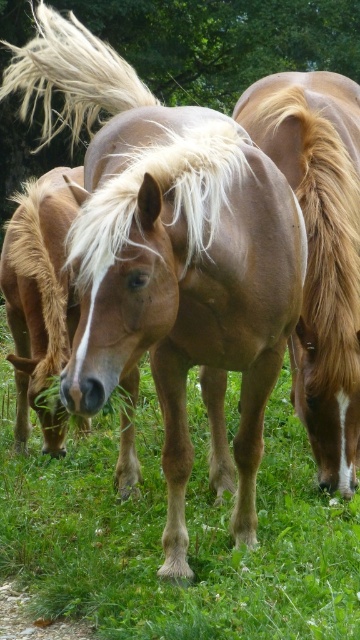
Question: Does brown glossy horse at center have a smaller size compared to white silky mane at center?

Choices:
 (A) yes
 (B) no

Answer: (B)

Question: Considering the real-world distances, which object is closest to the light brown glossy horse at center?

Choices:
 (A) brown glossy horse at center
 (B) white silky mane at center

Answer: (A)

Question: Does light brown glossy horse at center lie in front of white silky mane at center?

Choices:
 (A) no
 (B) yes

Answer: (A)

Question: Which is nearer to the brown glossy horse at center?

Choices:
 (A) light brown glossy horse at center
 (B) white silky mane at center

Answer: (A)

Question: Which point appears farthest from the camera in this image?

Choices:
 (A) (293, 588)
 (B) (136, 193)
 (C) (348, 262)

Answer: (C)

Question: Is light brown glossy horse at center to the right of white silky mane at center from the viewer's perspective?

Choices:
 (A) yes
 (B) no

Answer: (A)